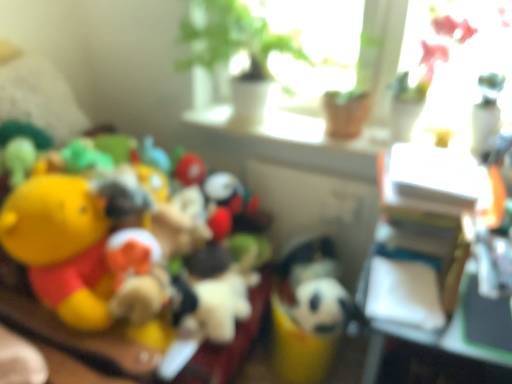
This screenshot has height=384, width=512. Describe the element at coordinates (324, 307) in the screenshot. I see `black plush toy at center` at that location.

Describe the element at coordinates (284, 141) in the screenshot. I see `white glossy window sill at upper center` at that location.

Measure the distance between white plush toy at center, which is the 2th toy in left-to-right order, and camera.

white plush toy at center, which is the 2th toy in left-to-right order, and camera are 4.74 feet apart from each other.

This screenshot has width=512, height=384. In order to click on black plush toy at center in this screenshot , I will do coord(324,307).

Between yellow plush toy at left, the 1th toy in the left-to-right sequence, and white plush toy at center, which is the 2th toy in left-to-right order, which one has more height?

Standing taller between the two is yellow plush toy at left, the 1th toy in the left-to-right sequence.

Consider the image. Considering the sizes of objects yellow plush toy at left, the 1th toy in the left-to-right sequence, and white plush toy at center, which is the 1th toy from right to left, in the image provided, who is thinner, yellow plush toy at left, the 1th toy in the left-to-right sequence, or white plush toy at center, which is the 1th toy from right to left,?

white plush toy at center, which is the 1th toy from right to left.

Is yellow plush toy at left, the 2th toy positioned from the right, next to white plush toy at center, which is the 2th toy in left-to-right order?

No, yellow plush toy at left, the 2th toy positioned from the right, is not in contact with white plush toy at center, which is the 2th toy in left-to-right order.

Between point (312, 150) and point (387, 228), which one is positioned in front?

The point (387, 228) is more forward.

Image resolution: width=512 pixels, height=384 pixels. Identify the location of table on the right of white glossy window sill at upper center. (420, 297).

Which of these two, white glossy window sill at upper center or white plastic table at right, stands taller?

white plastic table at right.

Consider the image. How far apart are white glossy window sill at upper center and white plastic table at right?

white glossy window sill at upper center and white plastic table at right are 27.31 inches apart.

What are the coordinates of `window sill behind the black plush toy at center` in the screenshot? It's located at (284, 141).

From a real-world perspective, is white glossy window sill at upper center located higher than black plush toy at center?

Yes, from a real-world perspective, white glossy window sill at upper center is above black plush toy at center.

Looking at this image, is white glossy window sill at upper center facing towards black plush toy at center?

No, white glossy window sill at upper center does not turn towards black plush toy at center.

From the picture: How many degrees apart are the facing directions of white glossy window sill at upper center and black plush toy at center?

3.17 degrees.

From the image's perspective, is black plush toy at center above white plush toy at center, which is the 1th toy from right to left?

Yes.

Can you confirm if black plush toy at center is positioned to the right of white plush toy at center, which is the 1th toy from right to left?

Indeed, black plush toy at center is positioned on the right side of white plush toy at center, which is the 1th toy from right to left.

Can you confirm if black plush toy at center is thinner than white plush toy at center, which is the 2th toy in left-to-right order?

Yes.

From a real-world perspective, is black plush toy at center above or below white plastic table at right?

Clearly, from a real-world perspective, black plush toy at center is above white plastic table at right.

Does point (300, 300) come in front of point (362, 311)?

No, (300, 300) is further to viewer.

In the scene shown: Is black plush toy at center aimed at white plastic table at right?

No.

Does white plush toy at center, which is the 2th toy in left-to-right order, lie behind white glossy window sill at upper center?

Yes.

What are the coordinates of `window sill in front of the white plush toy at center, which is the 2th toy in left-to-right order` in the screenshot? It's located at (284, 141).

From a real-world perspective, which object rests below the other?

white plush toy at center, which is the 2th toy in left-to-right order.

Can you confirm if white plastic table at right is shorter than white glossy window sill at upper center?

No, white plastic table at right is not shorter than white glossy window sill at upper center.

Can you confirm if white plastic table at right is positioned to the left of white glossy window sill at upper center?

In fact, white plastic table at right is to the right of white glossy window sill at upper center.

From a real-world perspective, is white plastic table at right beneath white glossy window sill at upper center?

Yes, from a real-world perspective, white plastic table at right is below white glossy window sill at upper center.

Which is nearer, (x=459, y=349) or (x=262, y=154)?

Point (x=459, y=349) is positioned closer to the camera compared to point (x=262, y=154).

You are a GUI agent. You are given a task and a screenshot of the screen. Output one action in this format:
    pyautogui.click(x=<x>, y=<y>)
    Task: Click on the toy above the white plush toy at center, which is the 1th toy from right to left (from a real-world perspective)
    The image size is (512, 384).
    Given the screenshot: What is the action you would take?
    pyautogui.click(x=99, y=248)

Where is `table below the white glossy window sill at upper center (from the image's perspective)`? The image size is (512, 384). table below the white glossy window sill at upper center (from the image's perspective) is located at coordinates (420, 297).

When comparing their distances from white plastic table at right, does white plush toy at center, which is the 1th toy from right to left, or black plush toy at center seem closer?

Based on the image, black plush toy at center appears to be nearer to white plastic table at right.

Based on their spatial positions, is black plush toy at center or white glossy window sill at upper center closer to yellow plush toy at left, the 2th toy positioned from the right?

The object closer to yellow plush toy at left, the 2th toy positioned from the right, is black plush toy at center.

Based on their spatial positions, is yellow plush toy at left, the 2th toy positioned from the right, or white plush toy at center, which is the 2th toy in left-to-right order, closer to white plastic table at right?

Among the two, white plush toy at center, which is the 2th toy in left-to-right order, is located nearer to white plastic table at right.

When comparing their distances from yellow plush toy at left, the 2th toy positioned from the right, does white plastic table at right or black plush toy at center seem closer?

black plush toy at center lies closer to yellow plush toy at left, the 2th toy positioned from the right, than the other object.

Which object lies further to the anchor point white plastic table at right, white glossy window sill at upper center or yellow plush toy at left, the 1th toy in the left-to-right sequence?

yellow plush toy at left, the 1th toy in the left-to-right sequence, is positioned further to the anchor white plastic table at right.

When comparing their distances from white plastic table at right, does yellow plush toy at left, the 1th toy in the left-to-right sequence, or white glossy window sill at upper center seem closer?

white glossy window sill at upper center is closer to white plastic table at right.

From the image, which object appears to be farther from black plush toy at center, white plush toy at center, which is the 2th toy in left-to-right order, or yellow plush toy at left, the 1th toy in the left-to-right sequence?

yellow plush toy at left, the 1th toy in the left-to-right sequence, lies further to black plush toy at center than the other object.

Based on their spatial positions, is white plush toy at center, which is the 1th toy from right to left, or yellow plush toy at left, the 2th toy positioned from the right, closer to white plastic table at right?

Among the two, white plush toy at center, which is the 1th toy from right to left, is located nearer to white plastic table at right.

The width and height of the screenshot is (512, 384). Identify the location of animal situated between yellow plush toy at left, the 2th toy positioned from the right, and white plastic table at right from left to right. (324, 307).

At what (x,y) coordinates should I click in order to perform the action: click on toy between yellow plush toy at left, the 2th toy positioned from the right, and white glossy window sill at upper center from left to right. Please return your answer as a coordinate pair (x, y). Image resolution: width=512 pixels, height=384 pixels. Looking at the image, I should click on pyautogui.click(x=309, y=312).

The image size is (512, 384). I want to click on animal between white glossy window sill at upper center and white plush toy at center, which is the 2th toy in left-to-right order, vertically, so click(x=324, y=307).

Where is `toy located between yellow plush toy at left, the 2th toy positioned from the right, and black plush toy at center in the left-right direction`? The width and height of the screenshot is (512, 384). toy located between yellow plush toy at left, the 2th toy positioned from the right, and black plush toy at center in the left-right direction is located at coordinates tap(309, 312).